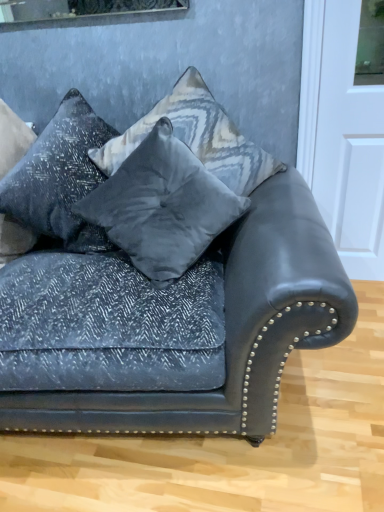
Describe the element at coordinates (343, 135) in the screenshot. I see `white glossy door at upper right` at that location.

This screenshot has height=512, width=384. In order to click on velvet gray pillow at center, the second pillow from the left in this screenshot , I will do `click(162, 206)`.

Which is closer, (185, 137) or (49, 197)?

Point (185, 137) is positioned closer to the camera compared to point (49, 197).

Is velvet gray pillow at center, the 3th pillow in the left-to-right sequence, located outside textured gray pillow at upper left, which is the first pillow in left-to-right order?

Yes.

How distant is velvet gray pillow at center, the 1th pillow from the right, from textured gray pillow at upper left, which is the 3th pillow from right to left?

velvet gray pillow at center, the 1th pillow from the right, and textured gray pillow at upper left, which is the 3th pillow from right to left, are 26.22 centimeters apart from each other.

What's the angular difference between velvet gray pillow at center, the 3th pillow in the left-to-right sequence, and textured gray pillow at upper left, which is the 3th pillow from right to left,'s facing directions?

0.000412 degrees separate the facing orientations of velvet gray pillow at center, the 3th pillow in the left-to-right sequence, and textured gray pillow at upper left, which is the 3th pillow from right to left.

Looking at this image, which of these two, textured gray pillow at upper left, which is the first pillow in left-to-right order, or velvet dark blue couch at center, is wider?

With larger width is velvet dark blue couch at center.

Is point (75, 143) positioned after point (122, 423)?

Yes, it is behind point (122, 423).

Looking at the image, does textured gray pillow at upper left, which is the 3th pillow from right to left, seem bigger or smaller compared to velvet dark blue couch at center?

In the image, textured gray pillow at upper left, which is the 3th pillow from right to left, appears to be smaller than velvet dark blue couch at center.

Considering the sizes of textured gray pillow at upper left, which is the 3th pillow from right to left, and velvet dark blue couch at center in the image, is textured gray pillow at upper left, which is the 3th pillow from right to left, taller or shorter than velvet dark blue couch at center?

Considering their sizes, textured gray pillow at upper left, which is the 3th pillow from right to left, has less height than velvet dark blue couch at center.

Considering the relative sizes of textured gray pillow at upper left, which is the 3th pillow from right to left, and velvet gray pillow at center, the 3th pillow in the left-to-right sequence, in the image provided, is textured gray pillow at upper left, which is the 3th pillow from right to left, taller than velvet gray pillow at center, the 3th pillow in the left-to-right sequence,?

Yes.

Are textured gray pillow at upper left, which is the 3th pillow from right to left, and velvet gray pillow at center, the 1th pillow from the right, making contact?

No, textured gray pillow at upper left, which is the 3th pillow from right to left, is not next to velvet gray pillow at center, the 1th pillow from the right.

Do you think textured gray pillow at upper left, which is the first pillow in left-to-right order, is within velvet gray pillow at center, the 3th pillow in the left-to-right sequence, or outside of it?

textured gray pillow at upper left, which is the first pillow in left-to-right order, is not inside velvet gray pillow at center, the 3th pillow in the left-to-right sequence, it's outside.

Considering the sizes of objects textured gray pillow at upper left, which is the 3th pillow from right to left, and velvet gray pillow at center, the 3th pillow in the left-to-right sequence, in the image provided, who is thinner, textured gray pillow at upper left, which is the 3th pillow from right to left, or velvet gray pillow at center, the 3th pillow in the left-to-right sequence,?

With smaller width is textured gray pillow at upper left, which is the 3th pillow from right to left.

This screenshot has height=512, width=384. In order to click on studio couch lying on the left of velvet gray pillow at center, the 3th pillow in the left-to-right sequence in this screenshot , I will do `click(161, 282)`.

From a real-world perspective, is velvet dark blue couch at center positioned above or below velvet gray pillow at center, the 1th pillow from the right?

In terms of real-world spatial position, velvet dark blue couch at center is below velvet gray pillow at center, the 1th pillow from the right.

From the image's perspective, is velvet dark blue couch at center below velvet gray pillow at center, the 3th pillow in the left-to-right sequence?

Yes, from the image's perspective, velvet dark blue couch at center is below velvet gray pillow at center, the 3th pillow in the left-to-right sequence.

In the scene shown: What's the angular difference between velvet dark blue couch at center and velvet gray pillow at center, the 1th pillow from the right,'s facing directions?

velvet dark blue couch at center and velvet gray pillow at center, the 1th pillow from the right, are facing 0.000147 degrees away from each other.

From a real-world perspective, who is located higher, velvet gray pillow at center, the second pillow from the left, or velvet gray pillow at center, the 1th pillow from the right?

velvet gray pillow at center, the 1th pillow from the right, is physically above.

Which of these two, velvet gray pillow at center, the second pillow from the left, or velvet gray pillow at center, the 3th pillow in the left-to-right sequence, is bigger?

velvet gray pillow at center, the 3th pillow in the left-to-right sequence, is bigger.

In the image, is velvet gray pillow at center, the second pillow from the left, positioned in front of or behind velvet gray pillow at center, the 1th pillow from the right?

velvet gray pillow at center, the second pillow from the left, is positioned closer to the viewer than velvet gray pillow at center, the 1th pillow from the right.

Which is closer, (133, 248) or (200, 149)?

The point (133, 248) is more forward.

Does white glossy door at upper right have a smaller size compared to velvet gray pillow at center, placed as the 2th pillow when sorted from right to left?

Correct, white glossy door at upper right occupies less space than velvet gray pillow at center, placed as the 2th pillow when sorted from right to left.

Is white glossy door at upper right facing away from velvet gray pillow at center, the second pillow from the left?

white glossy door at upper right does not have its back to velvet gray pillow at center, the second pillow from the left.

Considering the relative sizes of white glossy door at upper right and velvet gray pillow at center, the second pillow from the left, in the image provided, is white glossy door at upper right wider than velvet gray pillow at center, the second pillow from the left,?

No.

Considering the relative sizes of white glossy door at upper right and velvet gray pillow at center, the second pillow from the left, in the image provided, is white glossy door at upper right taller than velvet gray pillow at center, the second pillow from the left,?

Yes, white glossy door at upper right is taller than velvet gray pillow at center, the second pillow from the left.

Is textured gray pillow at upper left, which is the first pillow in left-to-right order, inside velvet dark blue couch at center?

Indeed, textured gray pillow at upper left, which is the first pillow in left-to-right order, is located within velvet dark blue couch at center.

Considering the relative sizes of velvet dark blue couch at center and textured gray pillow at upper left, which is the first pillow in left-to-right order, in the image provided, is velvet dark blue couch at center thinner than textured gray pillow at upper left, which is the first pillow in left-to-right order,?

Incorrect, the width of velvet dark blue couch at center is not less than that of textured gray pillow at upper left, which is the first pillow in left-to-right order.

Does velvet dark blue couch at center appear on the left side of textured gray pillow at upper left, which is the 3th pillow from right to left?

In fact, velvet dark blue couch at center is to the right of textured gray pillow at upper left, which is the 3th pillow from right to left.

In terms of size, does velvet dark blue couch at center appear bigger or smaller than textured gray pillow at upper left, which is the first pillow in left-to-right order?

In the image, velvet dark blue couch at center appears to be larger than textured gray pillow at upper left, which is the first pillow in left-to-right order.

From a real-world perspective, count 1st pillows downward from the velvet gray pillow at center, the 3th pillow in the left-to-right sequence, and point to it. Please provide its 2D coordinates.

[(60, 177)]

There is a velvet dark blue couch at center. At what (x,y) coordinates should I click in order to perform the action: click on the 2nd pillow above it (from the image's perspective). Please return your answer as a coordinate pair (x, y). The width and height of the screenshot is (384, 512). Looking at the image, I should click on (60, 177).

Estimate the real-world distances between objects in this image. Which object is further from velvet gray pillow at center, placed as the 2th pillow when sorted from right to left, white glossy door at upper right or velvet dark blue couch at center?

Among the two, white glossy door at upper right is located further to velvet gray pillow at center, placed as the 2th pillow when sorted from right to left.

Estimate the real-world distances between objects in this image. Which object is closer to velvet dark blue couch at center, white glossy door at upper right or velvet gray pillow at center, the 1th pillow from the right?

velvet gray pillow at center, the 1th pillow from the right, is closer to velvet dark blue couch at center.

In the scene shown: Considering their positions, is white glossy door at upper right positioned closer to velvet dark blue couch at center than textured gray pillow at upper left, which is the 3th pillow from right to left?

Among the two, textured gray pillow at upper left, which is the 3th pillow from right to left, is located nearer to velvet dark blue couch at center.

Looking at the image, which one is located closer to velvet dark blue couch at center, velvet gray pillow at center, placed as the 2th pillow when sorted from right to left, or white glossy door at upper right?

Based on the image, velvet gray pillow at center, placed as the 2th pillow when sorted from right to left, appears to be nearer to velvet dark blue couch at center.

From the image, which object appears to be nearer to velvet gray pillow at center, the 3th pillow in the left-to-right sequence, velvet dark blue couch at center or white glossy door at upper right?

Based on the image, velvet dark blue couch at center appears to be nearer to velvet gray pillow at center, the 3th pillow in the left-to-right sequence.

When comparing their distances from textured gray pillow at upper left, which is the 3th pillow from right to left, does velvet gray pillow at center, the 3th pillow in the left-to-right sequence, or velvet gray pillow at center, placed as the 2th pillow when sorted from right to left, seem further?

velvet gray pillow at center, the 3th pillow in the left-to-right sequence, lies further to textured gray pillow at upper left, which is the 3th pillow from right to left, than the other object.

Based on their spatial positions, is velvet gray pillow at center, placed as the 2th pillow when sorted from right to left, or velvet dark blue couch at center further from white glossy door at upper right?

The object further to white glossy door at upper right is velvet dark blue couch at center.

Estimate the real-world distances between objects in this image. Which object is further from velvet dark blue couch at center, velvet gray pillow at center, the second pillow from the left, or velvet gray pillow at center, the 1th pillow from the right?

The object further to velvet dark blue couch at center is velvet gray pillow at center, the 1th pillow from the right.

Locate an element on the screen. This screenshot has width=384, height=512. studio couch between textured gray pillow at upper left, which is the 3th pillow from right to left, and velvet gray pillow at center, placed as the 2th pillow when sorted from right to left, from left to right is located at coordinates (161, 282).

Find the location of a particular element. This screenshot has width=384, height=512. pillow situated between textured gray pillow at upper left, which is the first pillow in left-to-right order, and velvet gray pillow at center, the 3th pillow in the left-to-right sequence, from left to right is located at coordinates (162, 206).

You are a GUI agent. You are given a task and a screenshot of the screen. Output one action in this format:
    pyautogui.click(x=<x>, y=<y>)
    Task: Click on the studio couch between textured gray pillow at upper left, which is the first pillow in left-to-right order, and white glossy door at upper right from left to right
    
    Given the screenshot: What is the action you would take?
    pyautogui.click(x=161, y=282)

Locate an element on the screen. pillow located between velvet gray pillow at center, placed as the 2th pillow when sorted from right to left, and white glossy door at upper right in the left-right direction is located at coordinates (197, 137).